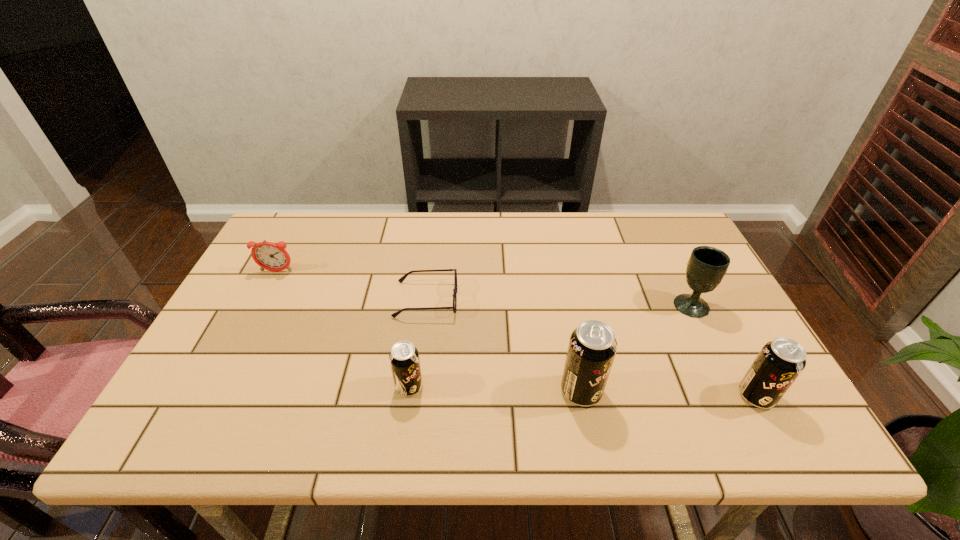
Where is `vacant position in the image that satisfies the following two spatial constraints: 1. on the front-facing side of the alarm clock; 2. on the left side of the rightmost soda can`? vacant position in the image that satisfies the following two spatial constraints: 1. on the front-facing side of the alarm clock; 2. on the left side of the rightmost soda can is located at coordinates (212, 396).

You are a GUI agent. You are given a task and a screenshot of the screen. Output one action in this format:
    pyautogui.click(x=<x>, y=<y>)
    Task: Click on the free space that satisfies the following two spatial constraints: 1. on the front-facing side of the second shortest object; 2. on the left side of the chalice
    This screenshot has width=960, height=540.
    Given the screenshot: What is the action you would take?
    pyautogui.click(x=259, y=305)

Identify the location of free space that satisfies the following two spatial constraints: 1. on the front-facing side of the spectacles; 2. on the back side of the chalice. (425, 305).

The image size is (960, 540). Identify the location of vacant space that satisfies the following two spatial constraints: 1. on the back side of the second soda can from right to left; 2. on the right side of the chalice. (x=564, y=305).

Locate an element on the screen. The width and height of the screenshot is (960, 540). blank space that satisfies the following two spatial constraints: 1. on the front-facing side of the leftmost object; 2. on the left side of the tallest soda can is located at coordinates (215, 391).

This screenshot has height=540, width=960. Identify the location of vacant region that satisfies the following two spatial constraints: 1. on the front-facing side of the farthest object; 2. on the right side of the leftmost soda can. (217, 387).

You are a GUI agent. You are given a task and a screenshot of the screen. Output one action in this format:
    pyautogui.click(x=<x>, y=<y>)
    Task: Click on the vacant space that satisfies the following two spatial constraints: 1. on the front-facing side of the fifth tallest object; 2. on the left side of the third object from right to left
    The width and height of the screenshot is (960, 540).
    Given the screenshot: What is the action you would take?
    pyautogui.click(x=215, y=391)